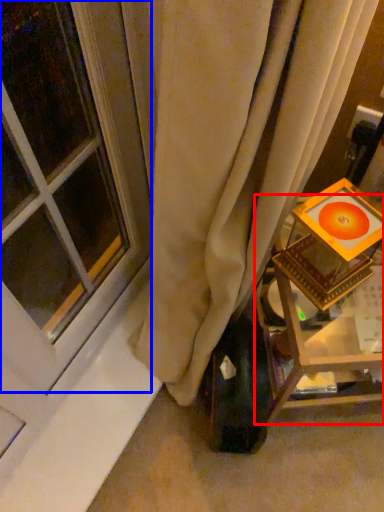
Question: Which object is closer to the camera taking this photo, furniture (highlighted by a red box) or window (highlighted by a blue box)?

Choices:
 (A) furniture
 (B) window

Answer: (B)